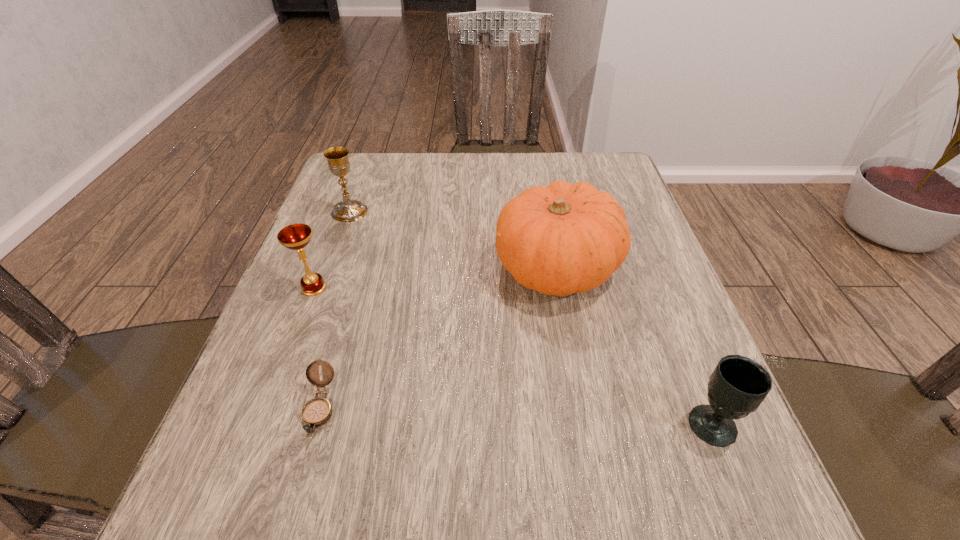
Locate an element on the screen. This screenshot has width=960, height=540. pumpkin is located at coordinates (561, 239).

You are a GUI agent. You are given a task and a screenshot of the screen. Output one action in this format:
    pyautogui.click(x=<x>, y=<y>)
    Task: Click on the farthest object
    
    Given the screenshot: What is the action you would take?
    pyautogui.click(x=348, y=210)

The width and height of the screenshot is (960, 540). I want to click on the second farthest chalice, so pos(297,236).

This screenshot has height=540, width=960. I want to click on the rightmost object, so click(738, 385).

The width and height of the screenshot is (960, 540). Find the location of `the rightmost chalice`. the rightmost chalice is located at coordinates (738, 385).

Where is `the shortest object`? The image size is (960, 540). the shortest object is located at coordinates pyautogui.click(x=316, y=412).

You are a GUI agent. You are given a task and a screenshot of the screen. Output one action in this format:
    pyautogui.click(x=<x>, y=<y>)
    Task: Click on the vacant area located 0.330m on the front of the pumpkin
    The image size is (960, 540).
    Given the screenshot: What is the action you would take?
    pyautogui.click(x=598, y=498)

This screenshot has width=960, height=540. I want to click on free space located 0.060m on the right of the farthest chalice, so click(x=392, y=212).

Image resolution: width=960 pixels, height=540 pixels. Find the location of `vacant area situated on the right of the second farthest chalice`. vacant area situated on the right of the second farthest chalice is located at coordinates (488, 288).

You are a GUI agent. You are given a task and a screenshot of the screen. Output one action in this format:
    pyautogui.click(x=<x>, y=<y>)
    Task: Click on the vacant space located on the back of the nearest chalice
    
    Given the screenshot: What is the action you would take?
    pyautogui.click(x=639, y=242)